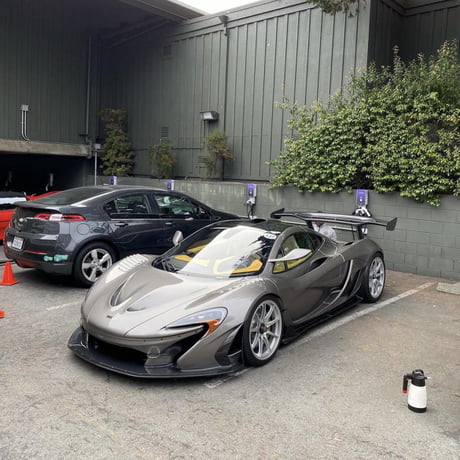
At what (x,y) coordinates should I click in order to perform the action: click on thermos. Please return your answer as a coordinate pair (x, y). The width and height of the screenshot is (460, 460). Looking at the image, I should click on (409, 397), (415, 390).